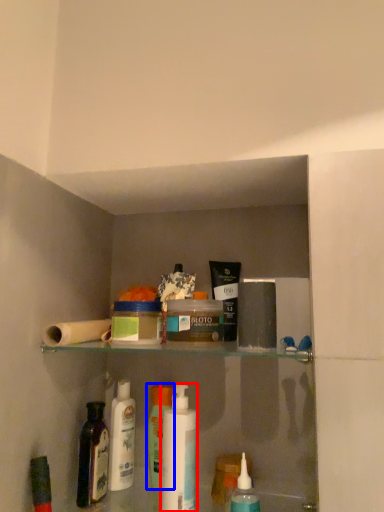
Question: Which of the following is the farthest to the observer, mouthwash (highlighted by a red box) or toiletry (highlighted by a blue box)?

Choices:
 (A) mouthwash
 (B) toiletry

Answer: (B)